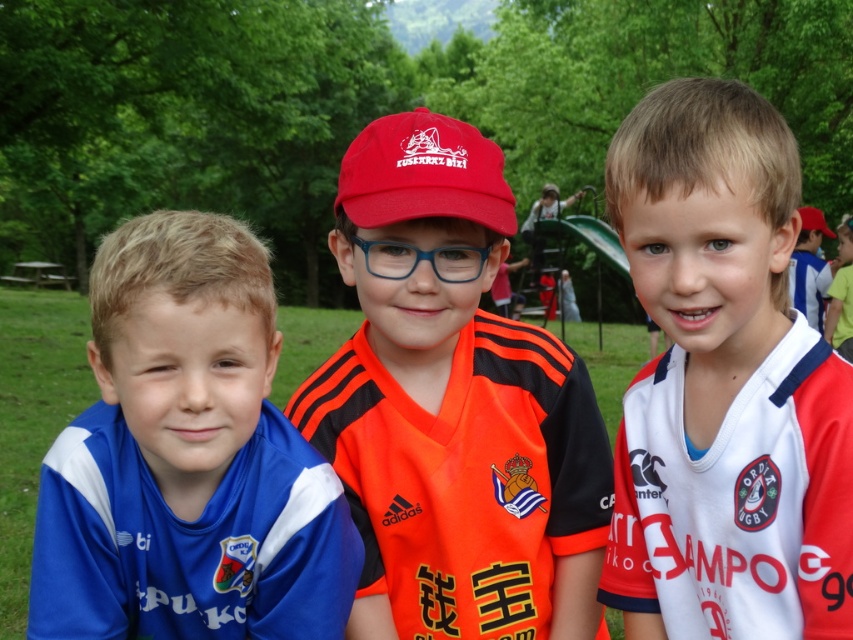
You are a photographer standing at the back of the park and want to take a photo of the blue jersey at left and orange jersey at center. Which boy will appear larger in the photo?

The blue jersey at left will appear larger in the photo because it is closer to the viewer than the orange jersey at center.

You are a photographer trying to capture a photo of the white jersey at center and the blue jersey at left. Since you can only focus on one subject at a time, which one should you focus on first if you want to follow the natural left to right reading order?

You should focus on the blue jersey at left first because it is on the left side, following the natural left to right reading order before focusing on the white jersey at center.

You are taking a photo of two points in the scene. The first point is at coordinate point (619, 237) and the second is at point (350, 412). Which point will appear larger in your photo?

Point (619, 237) is closer to the camera than point (350, 412), so it will appear larger in the photo.